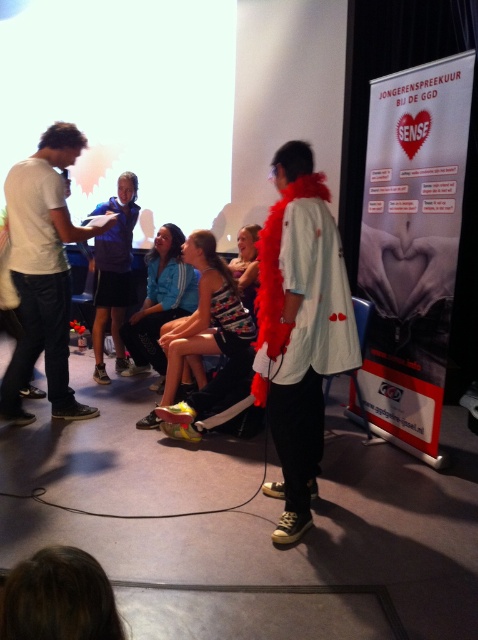
Question: Does white cotton shirt at left have a smaller size compared to dark blue shirt at center?

Choices:
 (A) yes
 (B) no

Answer: (B)

Question: Which point appears farthest from the camera in this image?

Choices:
 (A) (126, 240)
 (B) (226, 307)
 (C) (323, 353)

Answer: (A)

Question: Can you confirm if white cotton shirt at left is smaller than matte blue jacket at center?

Choices:
 (A) no
 (B) yes

Answer: (A)

Question: Estimate the real-world distances between objects in this image. Which object is farther from the white cotton shirt at left?

Choices:
 (A) matte blue jacket at center
 (B) dark blue shirt at center
 (C) white matte jacket at center
 (D) blue fabric jacket at center

Answer: (C)

Question: Is white cotton shirt at left above dark blue shirt at center?

Choices:
 (A) no
 (B) yes

Answer: (A)

Question: Which point is farther from the camera taking this photo?

Choices:
 (A) (249, 332)
 (B) (10, 365)

Answer: (B)